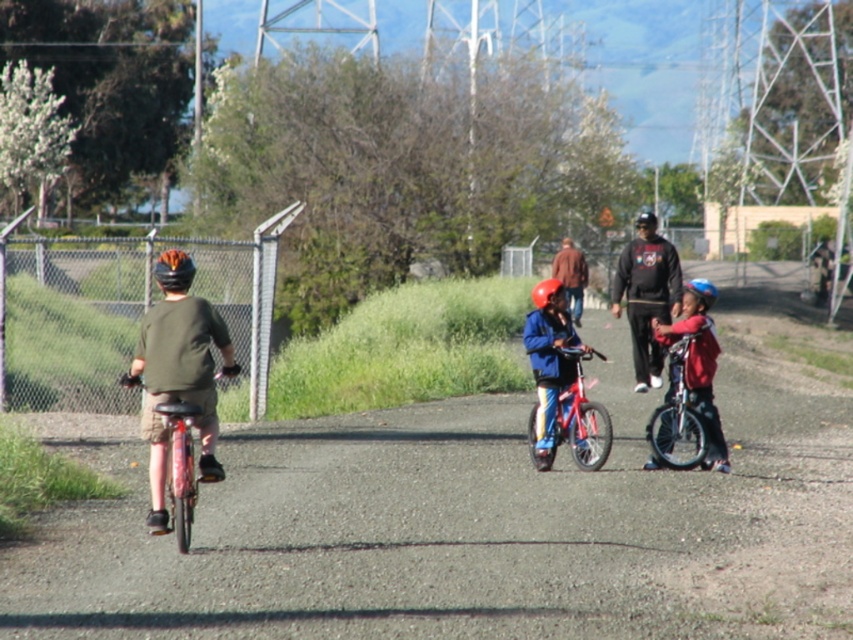
Does dark gray sweatshirt at center have a greater width compared to matte blue jacket at center?

Indeed, dark gray sweatshirt at center has a greater width compared to matte blue jacket at center.

Between point (622, 264) and point (572, 369), which one is positioned behind?

Positioned behind is point (622, 264).

Locate an element on the screen. Image resolution: width=853 pixels, height=640 pixels. dark gray sweatshirt at center is located at coordinates (646, 300).

Who is lower down, pink matte bicycle at left or blue matte helmet at center?

Positioned lower is pink matte bicycle at left.

This screenshot has width=853, height=640. What do you see at coordinates (180, 468) in the screenshot? I see `pink matte bicycle at left` at bounding box center [180, 468].

You are a GUI agent. You are given a task and a screenshot of the screen. Output one action in this format:
    pyautogui.click(x=<x>, y=<y>)
    Task: Click on the pink matte bicycle at left
    The width and height of the screenshot is (853, 640).
    Given the screenshot: What is the action you would take?
    pyautogui.click(x=180, y=468)

Is dark gray sweatshirt at center bigger than orange matte helmet at rear?

Yes.

Which of these two, dark gray sweatshirt at center or orange matte helmet at rear, stands shorter?

Result: orange matte helmet at rear

Is point (660, 378) farther from camera compared to point (158, 276)?

Yes, point (660, 378) is behind point (158, 276).

Where is `dark gray sweatshirt at center`? The height and width of the screenshot is (640, 853). dark gray sweatshirt at center is located at coordinates (646, 300).